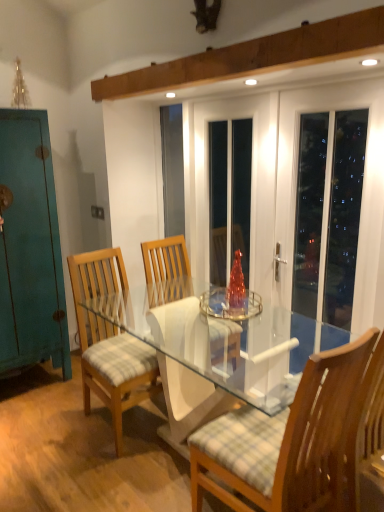
You are a GUI agent. You are given a task and a screenshot of the screen. Output one action in this format:
    pyautogui.click(x=<x>, y=<y>)
    Task: Click on the free space to the left of light brown wood chair at center, which ranks as the 2th chair in front-to-back order
    
    Given the screenshot: What is the action you would take?
    pyautogui.click(x=46, y=426)